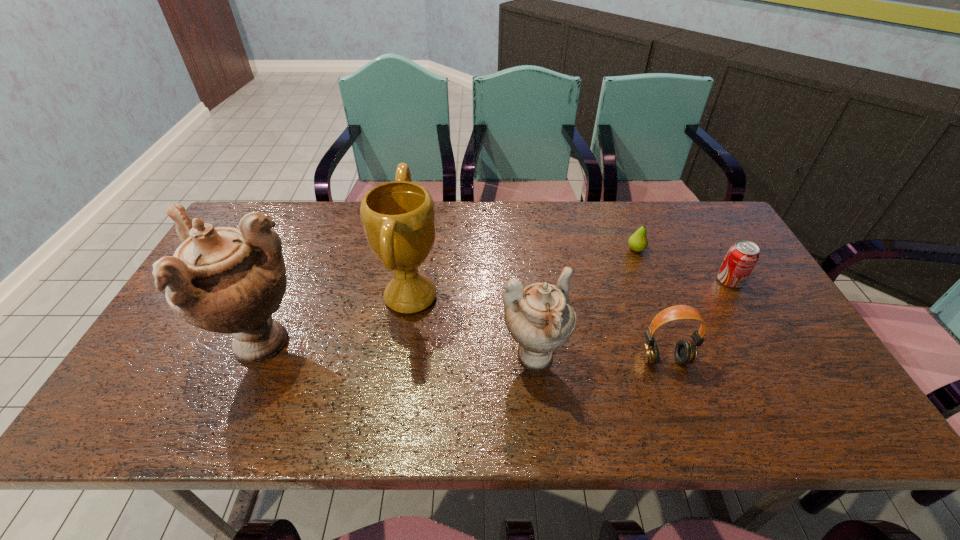
Locate an element on the screen. free space located on the back of the left urn is located at coordinates (282, 292).

Locate an element on the screen. vacant area located 0.090m on the left of the third tallest object is located at coordinates (463, 359).

The height and width of the screenshot is (540, 960). Identify the location of vacant space situated 0.290m on the left of the pear. (532, 249).

Locate an element on the screen. free space located 0.110m on the back of the rightmost object is located at coordinates (710, 247).

Locate an element on the screen. The image size is (960, 540). vacant space situated on the ear cups of the fourth tallest object is located at coordinates (677, 392).

This screenshot has width=960, height=540. I want to click on vacant point located 0.100m on the front of the award with the decoration, so click(x=479, y=296).

In order to click on object present at the far edge in this screenshot , I will do `click(638, 242)`.

Where is `headset that is positioned at the near edge`? headset that is positioned at the near edge is located at coordinates (685, 351).

Image resolution: width=960 pixels, height=540 pixels. What are the coordinates of `object present at the left edge` in the screenshot? It's located at (226, 280).

Where is `object at the right edge`? This screenshot has width=960, height=540. object at the right edge is located at coordinates (741, 258).